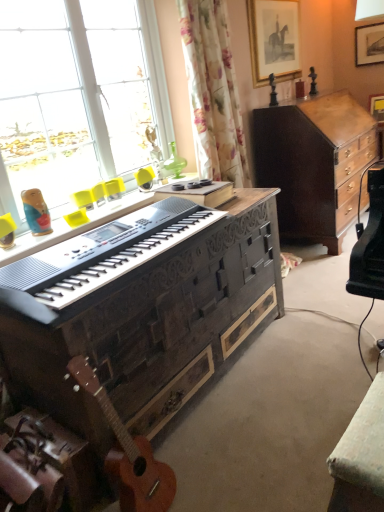
Question: Is black textured piano at center next to orange wood guitar at lower left?

Choices:
 (A) no
 (B) yes

Answer: (A)

Question: Can you confirm if black textured piano at center is bigger than orange wood guitar at lower left?

Choices:
 (A) yes
 (B) no

Answer: (A)

Question: Can you confirm if black textured piano at center is smaller than orange wood guitar at lower left?

Choices:
 (A) yes
 (B) no

Answer: (B)

Question: From a real-world perspective, is black textured piano at center under orange wood guitar at lower left?

Choices:
 (A) no
 (B) yes

Answer: (A)

Question: From a real-world perspective, is black textured piano at center physically above orange wood guitar at lower left?

Choices:
 (A) no
 (B) yes

Answer: (B)

Question: From the image's perspective, relative to black textured piano at center, is wooden picture frame at upper right, which appears as the first picture frame when viewed from the right, above or below?

Choices:
 (A) below
 (B) above

Answer: (B)

Question: From a real-world perspective, is wooden picture frame at upper right, which is the second picture frame in left-to-right order, positioned above or below black textured piano at center?

Choices:
 (A) above
 (B) below

Answer: (A)

Question: Considering the positions of wooden picture frame at upper right, which appears as the first picture frame when viewed from the right, and black textured piano at center in the image, is wooden picture frame at upper right, which appears as the first picture frame when viewed from the right, wider or thinner than black textured piano at center?

Choices:
 (A) wide
 (B) thin

Answer: (B)

Question: In the image, is wooden picture frame at upper right, which appears as the first picture frame when viewed from the right, positioned in front of or behind black textured piano at center?

Choices:
 (A) behind
 (B) front

Answer: (A)

Question: From a real-world perspective, is woodendesk at center positioned above or below black textured piano at center?

Choices:
 (A) below
 (B) above

Answer: (A)

Question: Is woodendesk at center spatially inside black textured piano at center, or outside of it?

Choices:
 (A) outside
 (B) inside

Answer: (A)

Question: Is woodendesk at center bigger or smaller than black textured piano at center?

Choices:
 (A) small
 (B) big

Answer: (B)

Question: From the image's perspective, is woodendesk at center located above or below black textured piano at center?

Choices:
 (A) above
 (B) below

Answer: (B)

Question: Is point (x=112, y=479) closer or farther from the camera than point (x=127, y=510)?

Choices:
 (A) closer
 (B) farther

Answer: (B)

Question: In terms of size, does woodendesk at center appear bigger or smaller than orange wood guitar at lower left?

Choices:
 (A) small
 (B) big

Answer: (B)